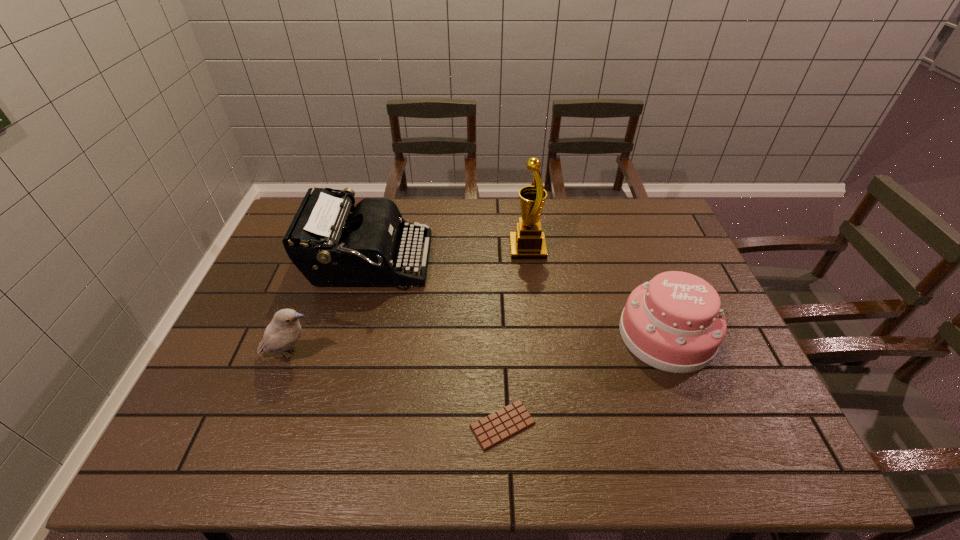
Image resolution: width=960 pixels, height=540 pixels. I want to click on award, so click(x=528, y=242).

What are the coordinates of `typewriter` in the screenshot? It's located at (330, 246).

I want to click on bird, so (x=283, y=332).

The image size is (960, 540). I want to click on birthday cake, so click(674, 323).

Identify the location of the nearest object. Image resolution: width=960 pixels, height=540 pixels. (491, 430).

Find the location of `the shortest object`. the shortest object is located at coordinates (491, 430).

The width and height of the screenshot is (960, 540). I want to click on vacant space located on the front-facing side of the award, so click(434, 249).

Identify the location of free space located on the front-facing side of the award. The width and height of the screenshot is (960, 540). 424,249.

Locate an element on the screen. The width and height of the screenshot is (960, 540). vacant space located 0.090m on the front-facing side of the award is located at coordinates (483, 249).

Locate an element on the screen. free space located 0.220m on the typing side of the typewriter is located at coordinates (498, 262).